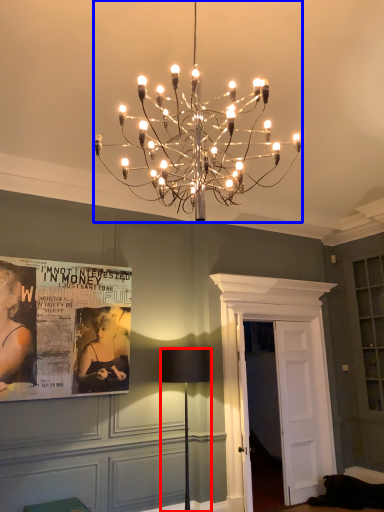
Question: Which of the following is the farthest to the observer, lamp (highlighted by a red box) or lamp (highlighted by a blue box)?

Choices:
 (A) lamp
 (B) lamp

Answer: (A)